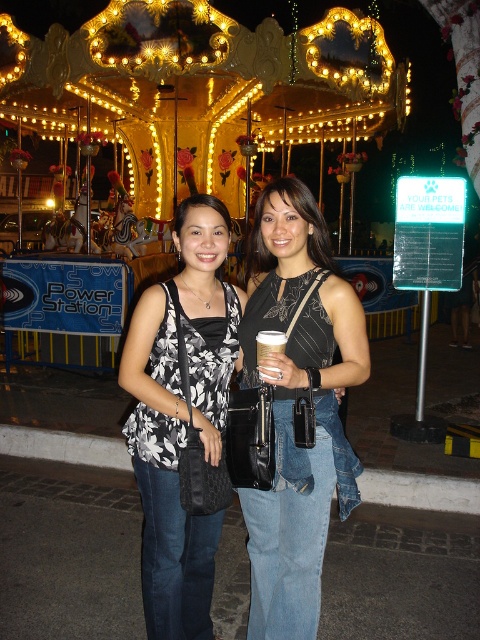
You are a photographer taking a picture of the black printed tank top at center and the white paper cup at center. Which object will appear closer to the camera in the photo?

The black printed tank top at center is in front of the white paper cup at center, so it will appear closer to the camera in the photo.